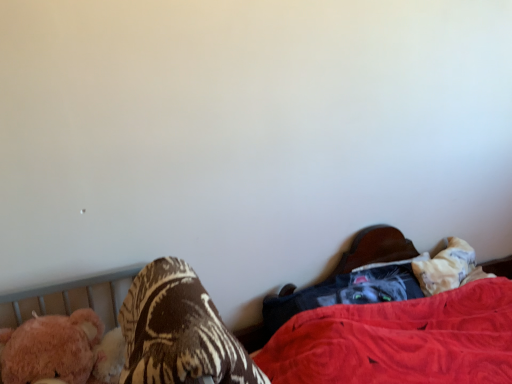
Describe the element at coordinates (375, 247) in the screenshot. Image resolution: width=512 pixels, height=384 pixels. I see `velvet black cat at lower right` at that location.

This screenshot has height=384, width=512. I want to click on fuzzy pink teddy bear at left, so click(x=51, y=348).

In order to click on velvet black cat at lower right in this screenshot , I will do `click(375, 247)`.

Find the location of a particular element. The height and width of the screenshot is (384, 512). bed on the right of fuzzy pink teddy bear at left is located at coordinates (375, 247).

From a real-world perspective, is fuzzy pink teddy bear at left below velvet black cat at lower right?

No.

In the scene shown: From their relative heights in the image, would you say fuzzy pink teddy bear at left is taller or shorter than velvet black cat at lower right?

In the image, fuzzy pink teddy bear at left appears to be shorter than velvet black cat at lower right.

Is velvet black cat at lower right surrounded by fuzzy pink teddy bear at left?

No, velvet black cat at lower right is not inside fuzzy pink teddy bear at left.

From the image's perspective, is fuzzy pink teddy bear at left under brown textured blanket at lower left?

Yes, from the image's perspective, fuzzy pink teddy bear at left is beneath brown textured blanket at lower left.

In the image, is fuzzy pink teddy bear at left positioned in front of or behind brown textured blanket at lower left?

fuzzy pink teddy bear at left is positioned farther from the viewer than brown textured blanket at lower left.

Is fuzzy pink teddy bear at left not inside brown textured blanket at lower left?

Indeed, fuzzy pink teddy bear at left is completely outside brown textured blanket at lower left.

Is fuzzy pink teddy bear at left next to brown textured blanket at lower left?

No, fuzzy pink teddy bear at left is not next to brown textured blanket at lower left.

Between brown textured blanket at lower left and dark gray fabric at lower right, which one appears on the left side from the viewer's perspective?

Positioned to the left is brown textured blanket at lower left.

Is brown textured blanket at lower left next to dark gray fabric at lower right and touching it?

They are not placed beside each other.

Is brown textured blanket at lower left inside the boundaries of dark gray fabric at lower right, or outside?

brown textured blanket at lower left is not inside dark gray fabric at lower right, it's outside.

Is brown textured blanket at lower left looking in the opposite direction of dark gray fabric at lower right?

No, brown textured blanket at lower left's orientation is not away from dark gray fabric at lower right.

In terms of height, does fuzzy pink teddy bear at left look taller or shorter compared to dark gray fabric at lower right?

Clearly, fuzzy pink teddy bear at left is taller compared to dark gray fabric at lower right.

Is fuzzy pink teddy bear at left not near dark gray fabric at lower right?

fuzzy pink teddy bear at left is actually quite close to dark gray fabric at lower right.

Based on the photo, looking at the image, does fuzzy pink teddy bear at left seem bigger or smaller compared to dark gray fabric at lower right?

Considering their sizes, fuzzy pink teddy bear at left takes up more space than dark gray fabric at lower right.

Based on the photo, considering the sizes of velvet black cat at lower right and brown textured blanket at lower left in the image, is velvet black cat at lower right wider or thinner than brown textured blanket at lower left?

velvet black cat at lower right is wider than brown textured blanket at lower left.

Is velvet black cat at lower right aimed at brown textured blanket at lower left?

No, velvet black cat at lower right is not turned towards brown textured blanket at lower left.

Can you tell me how much velvet black cat at lower right and brown textured blanket at lower left differ in facing direction?

They differ by 0.252 degrees in their facing directions.

Is velvet black cat at lower right at the right side of brown textured blanket at lower left?

Yes, velvet black cat at lower right is to the right of brown textured blanket at lower left.

Considering the relative sizes of dark gray fabric at lower right and velvet black cat at lower right in the image provided, is dark gray fabric at lower right smaller than velvet black cat at lower right?

Yes, dark gray fabric at lower right is smaller than velvet black cat at lower right.

Identify the location of bed in front of the dark gray fabric at lower right. The image size is (512, 384). (375, 247).

Can you tell me how much dark gray fabric at lower right and velvet black cat at lower right differ in facing direction?

7.41 degrees separate the facing orientations of dark gray fabric at lower right and velvet black cat at lower right.

Which object is closer to the camera taking this photo, dark gray fabric at lower right or velvet black cat at lower right?

velvet black cat at lower right is in front.

Is brown textured blanket at lower left facing away from velvet black cat at lower right?

No, velvet black cat at lower right is not at the back of brown textured blanket at lower left.

Is the position of brown textured blanket at lower left less distant than that of velvet black cat at lower right?

Yes, it is in front of velvet black cat at lower right.

Which of these two, brown textured blanket at lower left or velvet black cat at lower right, is bigger?

Bigger between the two is velvet black cat at lower right.

Are brown textured blanket at lower left and velvet black cat at lower right located far from each other?

brown textured blanket at lower left is actually quite close to velvet black cat at lower right.

The image size is (512, 384). I want to click on bed that appears on the right of fuzzy pink teddy bear at left, so click(x=375, y=247).

In order to click on footwear above the fuzzy pink teddy bear at left (from the image's perspective) in this screenshot , I will do `click(179, 332)`.

From the image, which object appears to be nearer to dark gray fabric at lower right, velvet black cat at lower right or brown textured blanket at lower left?

velvet black cat at lower right is closer to dark gray fabric at lower right.

Looking at the image, which one is located closer to brown textured blanket at lower left, fuzzy pink teddy bear at left or velvet black cat at lower right?

The object closer to brown textured blanket at lower left is fuzzy pink teddy bear at left.

When comparing their distances from fuzzy pink teddy bear at left, does dark gray fabric at lower right or velvet black cat at lower right seem closer?

Based on the image, dark gray fabric at lower right appears to be nearer to fuzzy pink teddy bear at left.

Considering their positions, is brown textured blanket at lower left positioned closer to fuzzy pink teddy bear at left than velvet black cat at lower right?

brown textured blanket at lower left lies closer to fuzzy pink teddy bear at left than the other object.

Which object lies further to the anchor point fuzzy pink teddy bear at left, brown textured blanket at lower left or dark gray fabric at lower right?

dark gray fabric at lower right is further to fuzzy pink teddy bear at left.

Estimate the real-world distances between objects in this image. Which object is further from brown textured blanket at lower left, dark gray fabric at lower right or velvet black cat at lower right?

velvet black cat at lower right.

Looking at the image, which one is located further to fuzzy pink teddy bear at left, velvet black cat at lower right or brown textured blanket at lower left?

velvet black cat at lower right is further to fuzzy pink teddy bear at left.

Considering their positions, is dark gray fabric at lower right positioned closer to velvet black cat at lower right than fuzzy pink teddy bear at left?

Among the two, dark gray fabric at lower right is located nearer to velvet black cat at lower right.

I want to click on clothing between brown textured blanket at lower left and velvet black cat at lower right from left to right, so click(343, 293).

The width and height of the screenshot is (512, 384). Find the location of `clothing between fuzzy pink teddy bear at left and velvet black cat at lower right`. clothing between fuzzy pink teddy bear at left and velvet black cat at lower right is located at coordinates pyautogui.click(x=343, y=293).

This screenshot has height=384, width=512. In order to click on footwear located between fuzzy pink teddy bear at left and velvet black cat at lower right in the left-right direction in this screenshot , I will do `click(179, 332)`.

Locate an element on the screen. The image size is (512, 384). footwear between fuzzy pink teddy bear at left and dark gray fabric at lower right is located at coordinates (179, 332).